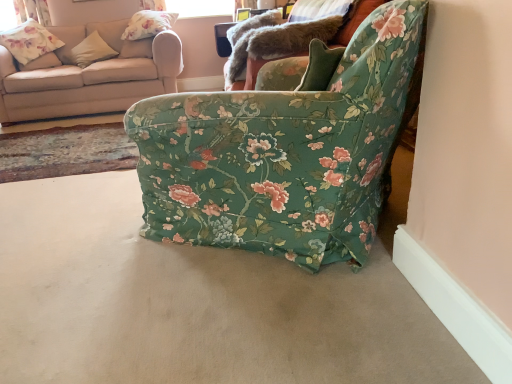
The height and width of the screenshot is (384, 512). I want to click on beige fabric couch at upper left, so click(x=89, y=75).

Find the location of `floral fabric pillow at upper left`. floral fabric pillow at upper left is located at coordinates (29, 41).

Describe the element at coordinates (194, 303) in the screenshot. I see `beige carpet at lower center` at that location.

This screenshot has height=384, width=512. What do you see at coordinates (32, 11) in the screenshot?
I see `floral fabric curtain at upper left` at bounding box center [32, 11].

Describe the element at coordinates (148, 24) in the screenshot. I see `floral fabric pillow at upper left, acting as the second pillow starting from the left` at that location.

Identify the location of beige fabric couch at upper left. (89, 75).

Is beige carpet at lower center positioned beyond the bounds of beige fabric couch at upper left?

beige carpet at lower center lies outside beige fabric couch at upper left's area.

Is beige carpet at lower center positioned behind beige fabric couch at upper left?

No.

Between beige carpet at lower center and beige fabric couch at upper left, which one has larger size?

beige fabric couch at upper left is bigger.

Does beige carpet at lower center appear on the left side of beige fabric couch at upper left?

In fact, beige carpet at lower center is to the right of beige fabric couch at upper left.

Can you confirm if floral fabric pillow at upper left, acting as the second pillow starting from the left, is shorter than beige carpet at lower center?

Incorrect, the height of floral fabric pillow at upper left, acting as the second pillow starting from the left, does not fall short of that of beige carpet at lower center.

Based on the photo, is floral fabric pillow at upper left, which appears as the first pillow when viewed from the right, closer to camera compared to beige carpet at lower center?

No.

Consider the image. Is beige carpet at lower center located within floral fabric pillow at upper left, acting as the second pillow starting from the left?

No, floral fabric pillow at upper left, acting as the second pillow starting from the left, does not contain beige carpet at lower center.

From a real-world perspective, is floral fabric pillow at upper left physically above beige fabric pillow at upper left, positioned as the 1th pillow in left-to-right order?

Correct, in the physical world, floral fabric pillow at upper left is higher than beige fabric pillow at upper left, positioned as the 1th pillow in left-to-right order.

How different are the orientations of floral fabric pillow at upper left and beige fabric pillow at upper left, which is counted as the 2th pillow, starting from the right, in degrees?

There is a 0.82-degree angle between the facing directions of floral fabric pillow at upper left and beige fabric pillow at upper left, which is counted as the 2th pillow, starting from the right.

Does floral fabric pillow at upper left have a larger size compared to beige fabric pillow at upper left, positioned as the 1th pillow in left-to-right order?

Correct, floral fabric pillow at upper left is larger in size than beige fabric pillow at upper left, positioned as the 1th pillow in left-to-right order.

Could you tell me if floral fabric pillow at upper left is facing beige fabric pillow at upper left, positioned as the 1th pillow in left-to-right order?

No, floral fabric pillow at upper left is not oriented towards beige fabric pillow at upper left, positioned as the 1th pillow in left-to-right order.

Looking at this image, would you say beige fabric pillow at upper left, positioned as the 1th pillow in left-to-right order, is outside floral fabric curtain at upper left?

That's correct, beige fabric pillow at upper left, positioned as the 1th pillow in left-to-right order, is outside of floral fabric curtain at upper left.

Which object is thinner, beige fabric pillow at upper left, which is counted as the 2th pillow, starting from the right, or floral fabric curtain at upper left?

floral fabric curtain at upper left is thinner.

Does beige fabric pillow at upper left, which is counted as the 2th pillow, starting from the right, appear on the right side of floral fabric curtain at upper left?

Indeed, beige fabric pillow at upper left, which is counted as the 2th pillow, starting from the right, is positioned on the right side of floral fabric curtain at upper left.

Is beige carpet at lower center shorter than floral fabric pillow at upper left, which appears as the first pillow when viewed from the right?

Indeed, beige carpet at lower center has a lesser height compared to floral fabric pillow at upper left, which appears as the first pillow when viewed from the right.

Which is behind, point (60, 252) or point (164, 30)?

The point (164, 30) is farther.

From a real-world perspective, which is physically below, beige carpet at lower center or floral fabric pillow at upper left, acting as the second pillow starting from the left?

beige carpet at lower center.

Based on the photo, is floral fabric pillow at upper left, acting as the second pillow starting from the left, surrounded by beige carpet at lower center?

No, floral fabric pillow at upper left, acting as the second pillow starting from the left, is located outside of beige carpet at lower center.

From a real-world perspective, between floral fabric pillow at upper left, which appears as the first pillow when viewed from the right, and floral fabric pillow at upper left, who is vertically lower?

From a 3D spatial view, floral fabric pillow at upper left is below.

Is floral fabric pillow at upper left inside floral fabric pillow at upper left, acting as the second pillow starting from the left?

No, floral fabric pillow at upper left is not surrounded by floral fabric pillow at upper left, acting as the second pillow starting from the left.

Is floral fabric pillow at upper left, acting as the second pillow starting from the left, shorter than floral fabric pillow at upper left?

Yes.

From the image's perspective, which one is positioned higher, floral fabric pillow at upper left, which appears as the first pillow when viewed from the right, or floral fabric pillow at upper left?

floral fabric pillow at upper left, which appears as the first pillow when viewed from the right, appears higher in the image.

Would you say beige carpet at lower center is to the left or to the right of beige fabric pillow at upper left, positioned as the 1th pillow in left-to-right order, in the picture?

Clearly, beige carpet at lower center is on the right of beige fabric pillow at upper left, positioned as the 1th pillow in left-to-right order, in the image.

In the scene shown: Is beige carpet at lower center turned away from beige fabric pillow at upper left, which is counted as the 2th pillow, starting from the right?

beige carpet at lower center is not turned away from beige fabric pillow at upper left, which is counted as the 2th pillow, starting from the right.

Is beige carpet at lower center taller or shorter than beige fabric pillow at upper left, positioned as the 1th pillow in left-to-right order?

Considering their sizes, beige carpet at lower center has less height than beige fabric pillow at upper left, positioned as the 1th pillow in left-to-right order.

Is beige carpet at lower center spatially inside beige fabric pillow at upper left, which is counted as the 2th pillow, starting from the right, or outside of it?

beige carpet at lower center is not enclosed by beige fabric pillow at upper left, which is counted as the 2th pillow, starting from the right.

You are a GUI agent. You are given a task and a screenshot of the screen. Output one action in this format:
    pyautogui.click(x=<x>, y=<y>)
    Task: Click on the studio couch above the beige carpet at lower center (from the image's perspective)
    This screenshot has width=512, height=384.
    Given the screenshot: What is the action you would take?
    pyautogui.click(x=89, y=75)

At what (x,y) coordinates should I click in order to perform the action: click on concrete below the floral fabric pillow at upper left, which appears as the first pillow when viewed from the right (from a real-world perspective). Please return your answer as a coordinate pair (x, y). Looking at the image, I should click on (194, 303).

In the scene shown: Estimate the real-world distances between objects in this image. Which object is closer to floral fabric pillow at upper left, which appears as the first pillow when viewed from the right, floral fabric armchair at center or beige fabric pillow at upper left, which is counted as the 2th pillow, starting from the right?

beige fabric pillow at upper left, which is counted as the 2th pillow, starting from the right.

Considering their positions, is floral fabric pillow at upper left positioned further to beige fabric pillow at upper left, which is counted as the 2th pillow, starting from the right, than beige carpet at lower center?

beige carpet at lower center is further to beige fabric pillow at upper left, which is counted as the 2th pillow, starting from the right.

Consider the image. Estimate the real-world distances between objects in this image. Which object is further from floral fabric armchair at center, beige fabric pillow at upper left, which is counted as the 2th pillow, starting from the right, or floral fabric pillow at upper left?

The object further to floral fabric armchair at center is floral fabric pillow at upper left.

In the scene shown: Considering their positions, is beige fabric couch at upper left positioned further to beige fabric pillow at upper left, positioned as the 1th pillow in left-to-right order, than beige carpet at lower center?

beige carpet at lower center is positioned further to the anchor beige fabric pillow at upper left, positioned as the 1th pillow in left-to-right order.

Considering their positions, is beige carpet at lower center positioned further to floral fabric curtain at upper left than floral fabric pillow at upper left?

The object further to floral fabric curtain at upper left is beige carpet at lower center.

Looking at the image, which one is located closer to beige fabric pillow at upper left, which is counted as the 2th pillow, starting from the right, floral fabric pillow at upper left or floral fabric pillow at upper left, acting as the second pillow starting from the left?

floral fabric pillow at upper left is closer to beige fabric pillow at upper left, which is counted as the 2th pillow, starting from the right.

In the scene shown: Based on their spatial positions, is floral fabric curtain at upper left or beige fabric pillow at upper left, which is counted as the 2th pillow, starting from the right, further from beige carpet at lower center?

floral fabric curtain at upper left is further to beige carpet at lower center.

Considering their positions, is beige carpet at lower center positioned further to floral fabric pillow at upper left, acting as the second pillow starting from the left, than beige fabric couch at upper left?

beige carpet at lower center.

Find the location of a particular element. This screenshot has width=512, height=384. flower between floral fabric curtain at upper left and floral fabric pillow at upper left, acting as the second pillow starting from the left, from left to right is located at coordinates (29, 41).

Find the location of a particular element. Image resolution: width=512 pixels, height=384 pixels. flower located between beige carpet at lower center and floral fabric pillow at upper left, which appears as the first pillow when viewed from the right, in the depth direction is located at coordinates (29, 41).

Locate an element on the screen. studio couch positioned between floral fabric armchair at center and floral fabric pillow at upper left, acting as the second pillow starting from the left, from near to far is located at coordinates click(89, 75).

At what (x,y) coordinates should I click in order to perform the action: click on studio couch between floral fabric armchair at center and floral fabric pillow at upper left in the front-back direction. Please return your answer as a coordinate pair (x, y). The width and height of the screenshot is (512, 384). Looking at the image, I should click on (89, 75).